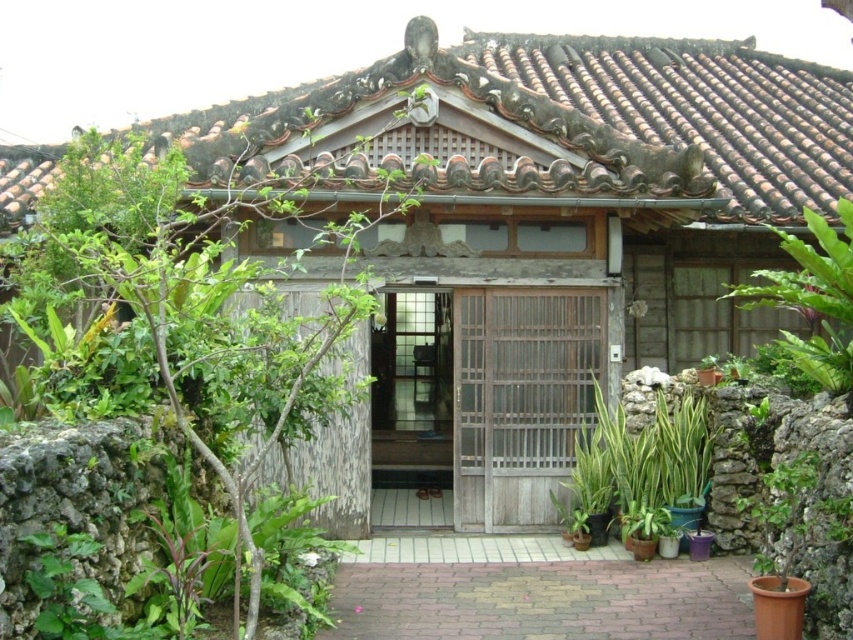
You are standing at the entrance of the traditional Japanese house and want to place a new decorative item. Where should you place it so it aligns with the existing green leafy plant at left?

The green leafy plant at left is positioned at coordinates point (178, 308), so you should place the new decorative item at the same coordinates to align with it.